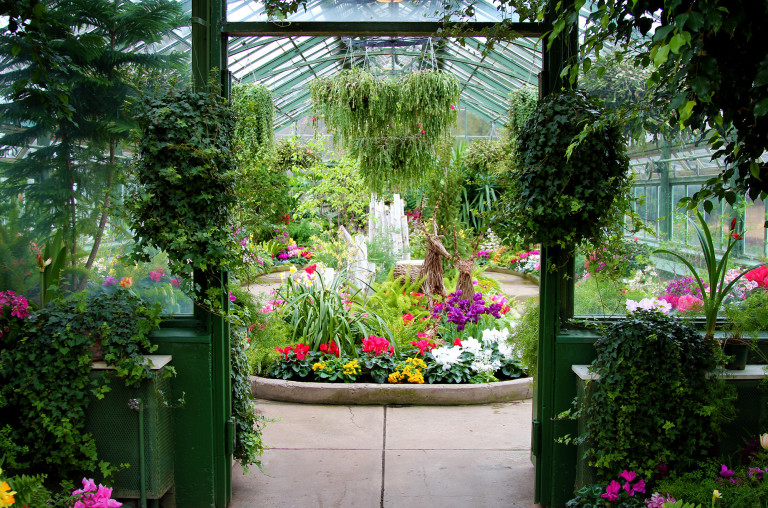
Identify the location of hanging plants. This screenshot has width=768, height=508. (343, 97), (422, 102), (388, 144), (257, 115), (522, 107).